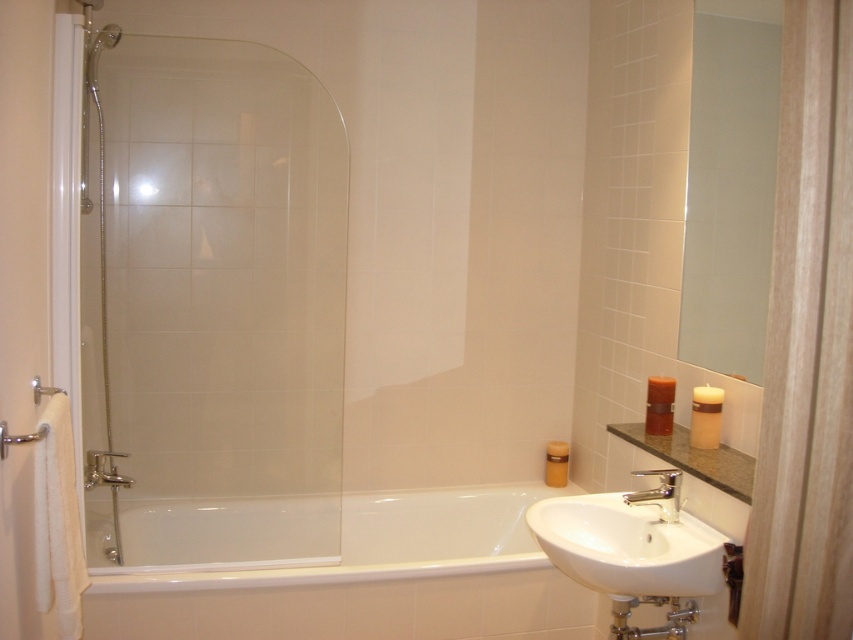
From the picture: You are a delivery person trying to place a package that is 1 meter long between the wooden screen door at right and the silver metallic faucet at lower center. Can the package fit in the space between them?

The distance between the wooden screen door at right and the silver metallic faucet at lower center is 76.33 centimeters. Since the package is 1 meter long, which is longer than the available space, the package cannot fit between them.

You are standing in the bathroom and want to place a small plant between the two points labeled point (223, 250) and point (669, 508). Which point should the plant be closer to in order to be nearer to the viewer?

The plant should be closer to point (223, 250) because it is closer to the viewer than point (669, 508).

You are trying to enter the bathroom and need to walk around the clear glass shower door at left and the white glossy bathtub at center. Which object should you move around first?

You should move around the clear glass shower door at left first because it is in front of the white glossy bathtub at center, making it closer to your path.